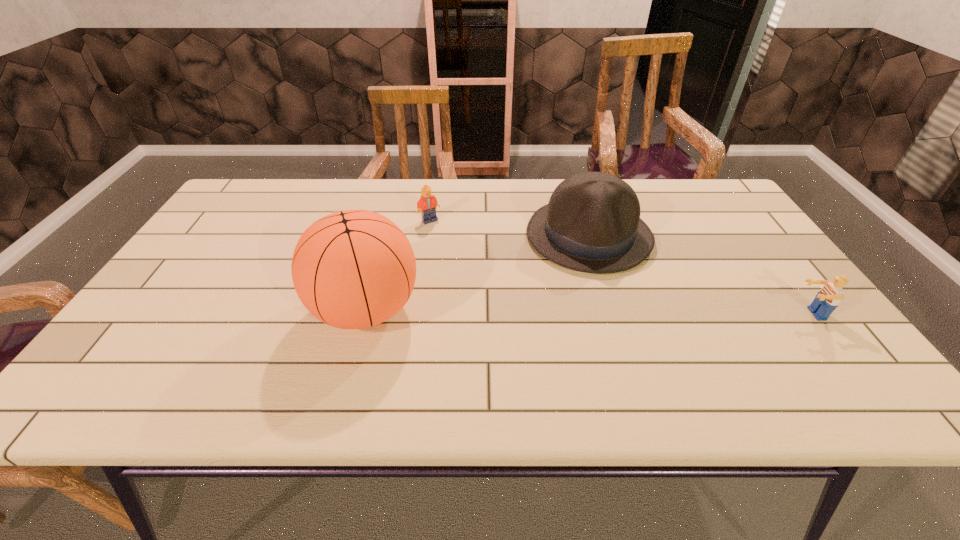
The width and height of the screenshot is (960, 540). In order to click on bowler hat present at the far edge in this screenshot , I will do `click(592, 224)`.

This screenshot has height=540, width=960. I want to click on Lego located at the far edge, so click(x=427, y=204).

Locate an element on the screen. escargot that is at the far edge is located at coordinates (337, 206).

You are a GUI agent. You are given a task and a screenshot of the screen. Output one action in this format:
    pyautogui.click(x=<x>, y=<y>)
    Task: Click on the object that is at the near edge
    This screenshot has width=960, height=540.
    Given the screenshot: What is the action you would take?
    pyautogui.click(x=352, y=269)

Find the location of a particular element. object located in the right edge section of the desktop is located at coordinates (828, 298).

Find the location of `vacant space at the far edge`. vacant space at the far edge is located at coordinates (478, 192).

Where is `vacant area at the near edge of the desktop`? This screenshot has width=960, height=540. vacant area at the near edge of the desktop is located at coordinates coord(468,363).

Image resolution: width=960 pixels, height=540 pixels. In the image, there is a desktop. Find the location of `free space at the left edge`. free space at the left edge is located at coordinates (168, 293).

In the image, there is a desktop. Identify the location of vacant area at the right edge. (768, 298).

The image size is (960, 540). I want to click on vacant point at the far left corner, so click(x=264, y=183).